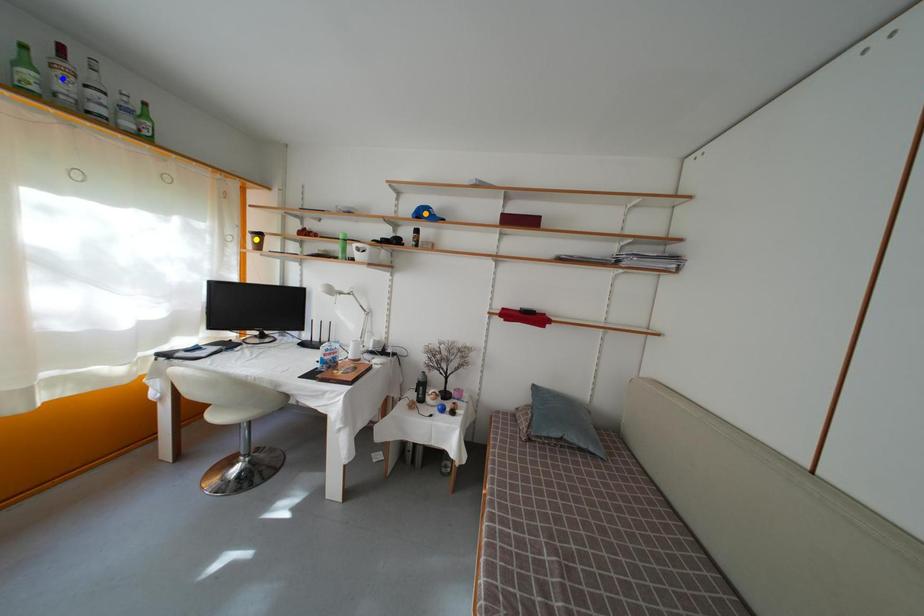
Order these from farthest to nearest:
- yellow point
- blue point
- orange point

yellow point, orange point, blue point